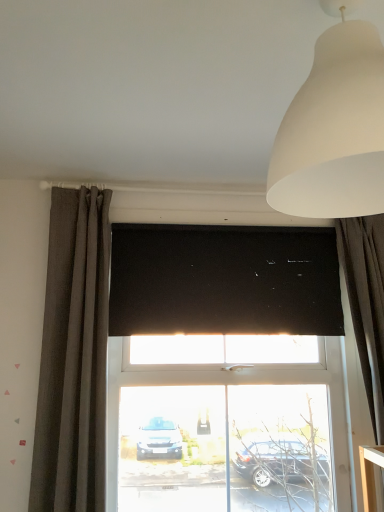
Question: Should I look upward or downward to see dark gray textured curtain at left, the 1th curtain viewed from the left?

Choices:
 (A) down
 (B) up

Answer: (A)

Question: From the image's perspective, is white matte lampshade at upper right on top of dark gray textured curtain at left, the 1th curtain viewed from the left?

Choices:
 (A) yes
 (B) no

Answer: (A)

Question: Is white matte lampshade at upper right positioned before dark gray textured curtain at left, the 1th curtain viewed from the left?

Choices:
 (A) no
 (B) yes

Answer: (B)

Question: Considering the relative sizes of white matte lampshade at upper right and dark gray textured curtain at left, the 1th curtain viewed from the left, in the image provided, is white matte lampshade at upper right smaller than dark gray textured curtain at left, the 1th curtain viewed from the left,?

Choices:
 (A) yes
 (B) no

Answer: (A)

Question: Is white matte lampshade at upper right bigger than dark gray textured curtain at left, the 1th curtain viewed from the left?

Choices:
 (A) no
 (B) yes

Answer: (A)

Question: Would you consider white matte lampshade at upper right to be distant from dark gray textured curtain at left, positioned as the 2th curtain in right-to-left order?

Choices:
 (A) no
 (B) yes

Answer: (B)

Question: From a real-world perspective, does white matte lampshade at upper right stand above dark gray textured curtain at left, the 1th curtain viewed from the left?

Choices:
 (A) yes
 (B) no

Answer: (A)

Question: Does black matte window screen at center have a larger size compared to dark grey fabric curtain at right, the second curtain from the left?

Choices:
 (A) yes
 (B) no

Answer: (B)

Question: From a real-world perspective, does black matte window screen at center sit lower than dark grey fabric curtain at right, the first curtain viewed from the right?

Choices:
 (A) no
 (B) yes

Answer: (A)

Question: Is black matte window screen at center shorter than dark grey fabric curtain at right, the second curtain from the left?

Choices:
 (A) yes
 (B) no

Answer: (A)

Question: Is black matte window screen at center at the right side of dark grey fabric curtain at right, the second curtain from the left?

Choices:
 (A) yes
 (B) no

Answer: (B)

Question: Is the position of black matte window screen at center less distant than that of dark grey fabric curtain at right, the first curtain viewed from the right?

Choices:
 (A) yes
 (B) no

Answer: (B)

Question: Is black matte window screen at center positioned far away from dark grey fabric curtain at right, the first curtain viewed from the right?

Choices:
 (A) no
 (B) yes

Answer: (A)

Question: Considering the relative sizes of dark gray textured curtain at left, positioned as the 2th curtain in right-to-left order, and white matte lampshade at upper right in the image provided, is dark gray textured curtain at left, positioned as the 2th curtain in right-to-left order, shorter than white matte lampshade at upper right?

Choices:
 (A) yes
 (B) no

Answer: (B)